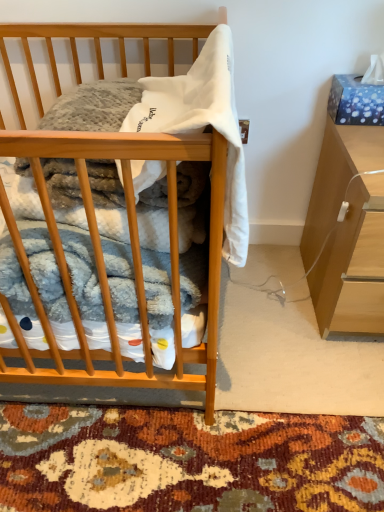
Find the location of a particular element. The height and width of the screenshot is (512, 384). white soft fabric at center is located at coordinates (203, 124).

Measure the distance between white soft fabric at center and camera.

The depth of white soft fabric at center is 23.50 inches.

Locate an element on the screen. Image resolution: width=384 pixels, height=512 pixels. wooden desk at center is located at coordinates (127, 216).

The width and height of the screenshot is (384, 512). What are the coordinates of `white soft fabric at center` in the screenshot? It's located at (203, 124).

What's the angular difference between wooden desk at center and white soft fabric at center's facing directions?

Answer: There is a 90-degree angle between the facing directions of wooden desk at center and white soft fabric at center.

Considering the sizes of objects wooden desk at center and white soft fabric at center in the image provided, who is bigger, wooden desk at center or white soft fabric at center?

wooden desk at center.

From the picture: Is wooden desk at center facing towards white soft fabric at center?

Yes, wooden desk at center is aimed at white soft fabric at center.

Which object is positioned more to the right, wooden desk at center or white soft fabric at center?

From the viewer's perspective, white soft fabric at center appears more on the right side.

Is light brown wood cabinet at right at the back of wooden desk at center?

No, wooden desk at center is not facing away from light brown wood cabinet at right.

Which of these two, wooden desk at center or light brown wood cabinet at right, is wider?

Wider between the two is wooden desk at center.

From the image's perspective, does light brown wood cabinet at right appear higher than white soft fabric at center?

No.

Could you tell me if light brown wood cabinet at right is facing white soft fabric at center?

No, light brown wood cabinet at right is not facing towards white soft fabric at center.

Is light brown wood cabinet at right at the left side of white soft fabric at center?

No.

From a real-world perspective, is light brown wood cabinet at right on top of white soft fabric at center?

No, from a real-world perspective, light brown wood cabinet at right is not above white soft fabric at center.

Is white soft fabric at center not close to wooden desk at center?

No, white soft fabric at center is in close proximity to wooden desk at center.

Which is in front, white soft fabric at center or wooden desk at center?

wooden desk at center is in front.

Is white soft fabric at center to the left of wooden desk at center from the viewer's perspective?

In fact, white soft fabric at center is to the right of wooden desk at center.

Which is further, (120,178) or (64,377)?

The point (64,377) is behind.

Where is `cabinetry behind the wooden desk at center`? The width and height of the screenshot is (384, 512). cabinetry behind the wooden desk at center is located at coordinates (353, 265).

Considering the relative sizes of light brown wood cabinet at right and wooden desk at center in the image provided, is light brown wood cabinet at right smaller than wooden desk at center?

Indeed, light brown wood cabinet at right has a smaller size compared to wooden desk at center.

From a real-world perspective, is light brown wood cabinet at right below wooden desk at center?

Yes, from a real-world perspective, light brown wood cabinet at right is beneath wooden desk at center.

Can you confirm if light brown wood cabinet at right is wider than wooden desk at center?

No.

Is white soft fabric at center in contact with light brown wood cabinet at right?

They are not placed beside each other.

From a real-world perspective, is white soft fabric at center on top of light brown wood cabinet at right?

Yes, from a real-world perspective, white soft fabric at center is above light brown wood cabinet at right.

Does white soft fabric at center have a larger size compared to light brown wood cabinet at right?

Incorrect, white soft fabric at center is not larger than light brown wood cabinet at right.

Is white soft fabric at center taller or shorter than light brown wood cabinet at right?

Considering their sizes, white soft fabric at center has less height than light brown wood cabinet at right.

Where is `desk that is under the white soft fabric at center (from a real-world perspective)`? desk that is under the white soft fabric at center (from a real-world perspective) is located at coordinates (127, 216).

Find the location of a particular element. desk on the left of light brown wood cabinet at right is located at coordinates (127, 216).

Which object lies nearer to the anchor point light brown wood cabinet at right, wooden desk at center or white soft fabric at center?

white soft fabric at center lies closer to light brown wood cabinet at right than the other object.

Consider the image. Which object lies further to the anchor point white soft fabric at center, light brown wood cabinet at right or wooden desk at center?

light brown wood cabinet at right is positioned further to the anchor white soft fabric at center.

Consider the image. Which object lies further to the anchor point light brown wood cabinet at right, white soft fabric at center or wooden desk at center?

Based on the image, wooden desk at center appears to be further to light brown wood cabinet at right.

Looking at the image, which one is located closer to wooden desk at center, light brown wood cabinet at right or white soft fabric at center?

white soft fabric at center.

From the image, which object appears to be farther from white soft fabric at center, wooden desk at center or light brown wood cabinet at right?

light brown wood cabinet at right is further to white soft fabric at center.

Based on the photo, based on their spatial positions, is white soft fabric at center or light brown wood cabinet at right closer to wooden desk at center?

The object closer to wooden desk at center is white soft fabric at center.

Locate an element on the screen. The height and width of the screenshot is (512, 384). baby clothe between wooden desk at center and light brown wood cabinet at right is located at coordinates (203, 124).